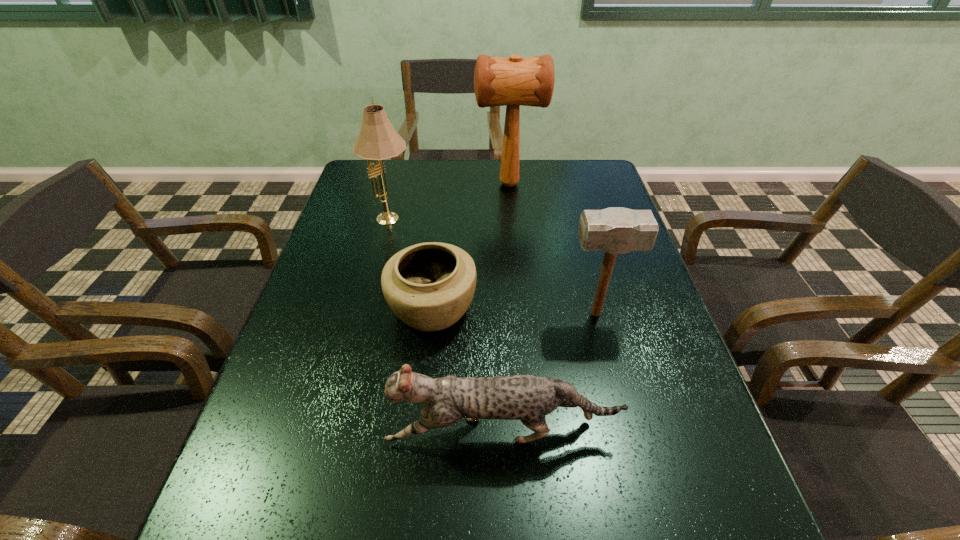
Locate an element on the screen. free space located 0.110m on the strike surface of the taller mallet is located at coordinates (442, 184).

Locate an element on the screen. Image resolution: width=960 pixels, height=540 pixels. blank space located on the front of the lampshade is located at coordinates (379, 268).

The image size is (960, 540). In order to click on free spot located on the striking face of the nearer mallet in this screenshot , I will do `click(528, 314)`.

Where is `vacant space located 0.230m on the striking face of the nearer mallet`? This screenshot has height=540, width=960. vacant space located 0.230m on the striking face of the nearer mallet is located at coordinates (468, 314).

Find the location of `free location located on the striking face of the nearer mallet`. free location located on the striking face of the nearer mallet is located at coordinates click(x=397, y=314).

Where is `blank space located on the face of the cat`? This screenshot has width=960, height=540. blank space located on the face of the cat is located at coordinates (286, 432).

At what (x,y) coordinates should I click in order to perform the action: click on free space located 0.210m on the face of the cat. Please return your answer as a coordinate pair (x, y). This screenshot has width=960, height=540. Looking at the image, I should click on (276, 432).

The image size is (960, 540). What are the coordinates of `free location located on the face of the cat` in the screenshot? It's located at (318, 432).

Image resolution: width=960 pixels, height=540 pixels. Identify the location of free location located on the front of the shortest object. (423, 392).

Identify the location of object present at the far edge. (511, 82).